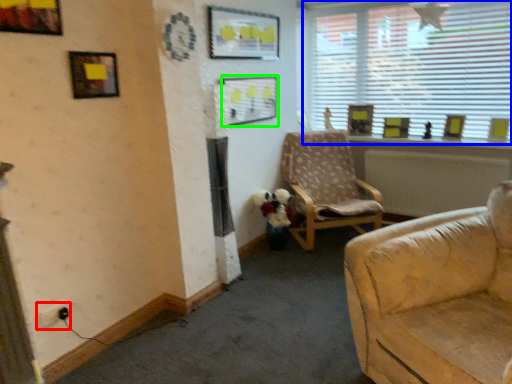
Question: Which object is positioned closest to electric outlet (highlighted by a red box)? Select from window (highlighted by a blue box) and picture frame (highlighted by a green box).

Choices:
 (A) window
 (B) picture frame

Answer: (B)